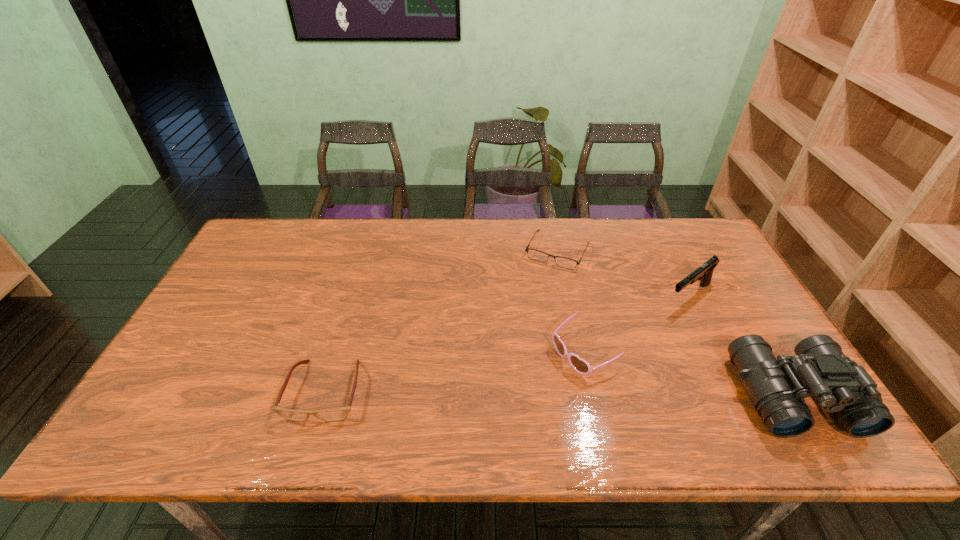
The width and height of the screenshot is (960, 540). In order to click on empty location between the shorter spectacles and the leftmost object in this screenshot , I will do `click(442, 321)`.

You are a GUI agent. You are given a task and a screenshot of the screen. Output one action in this format:
    pyautogui.click(x=<x>, y=<y>)
    Task: Click on the free spot between the right spectacles and the binoculars
    The width and height of the screenshot is (960, 540).
    Given the screenshot: What is the action you would take?
    pyautogui.click(x=676, y=323)

Locate an element on the screen. The image size is (960, 540). vacant area that lies between the sunglasses and the farther spectacles is located at coordinates (570, 301).

Locate an element on the screen. This screenshot has width=960, height=540. vacant area that lies between the gun and the nearer spectacles is located at coordinates (507, 343).

This screenshot has height=540, width=960. In order to click on vacant region between the binoculars and the sunglasses in this screenshot , I will do `click(688, 374)`.

The width and height of the screenshot is (960, 540). Identify the location of unoccupied area between the shortest object and the binoculars. (676, 323).

At what (x,y) coordinates should I click in order to perform the action: click on free space between the sunglasses and the second farthest object. Please return your answer as a coordinate pair (x, y). Looking at the image, I should click on (636, 324).

Where is `free space between the binoculars and the sunglasses`? The width and height of the screenshot is (960, 540). free space between the binoculars and the sunglasses is located at coordinates (x=688, y=374).

I want to click on blank region between the second shortest object and the fourth shortest object, so click(507, 343).

Where is `object that is the second nearest to the binoculars`? object that is the second nearest to the binoculars is located at coordinates (581, 366).